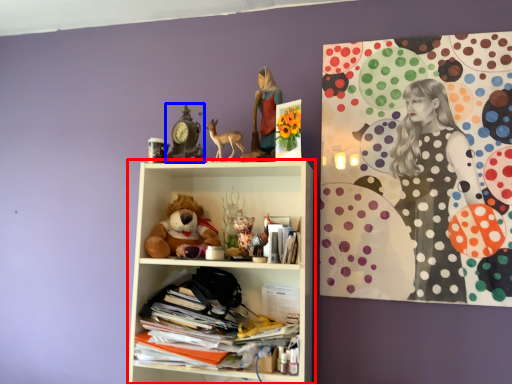
Question: Which of the following is the farthest to the observer, shelf (highlighted by a red box) or art (highlighted by a blue box)?

Choices:
 (A) shelf
 (B) art

Answer: (B)